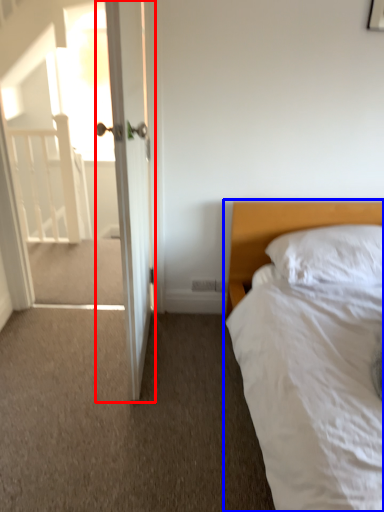
Question: Which point is further to the camera, door (highlighted by a red box) or bed (highlighted by a blue box)?

Choices:
 (A) door
 (B) bed

Answer: (A)